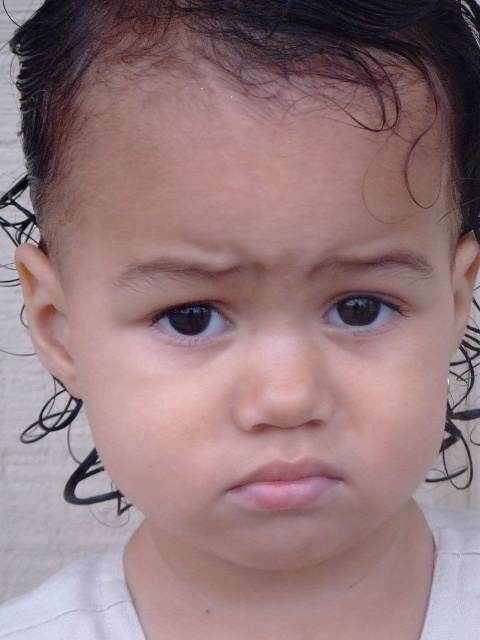
In the scene shown: Can you confirm if brown glossy eye at center is wider than brown glossy eye at center left?

Correct, the width of brown glossy eye at center exceeds that of brown glossy eye at center left.

Who is more distant from viewer, (356,298) or (190,317)?

The point (356,298) is behind.

Who is more forward, (383, 298) or (156, 317)?

Point (156, 317) is in front.

The width and height of the screenshot is (480, 640). I want to click on brown glossy eye at center, so click(362, 310).

Which is more to the left, pink smooth lips at center or brown glossy eye at center?

Positioned to the left is pink smooth lips at center.

The width and height of the screenshot is (480, 640). I want to click on pink smooth lips at center, so click(x=285, y=484).

Is point (295, 486) positioned in front of point (382, 294)?

Yes, point (295, 486) is in front of point (382, 294).

The width and height of the screenshot is (480, 640). What are the coordinates of `pink smooth lips at center` in the screenshot? It's located at [285, 484].

Can you confirm if pink smooth lips at center is wider than brown glossy eye at center left?

Yes.

Is point (312, 488) closer to camera compared to point (190, 324)?

Yes.

Who is more distant from viewer, (240, 483) or (215, 337)?

The point (240, 483) is more distant.

This screenshot has height=640, width=480. Identify the location of pink smooth lips at center. (285, 484).